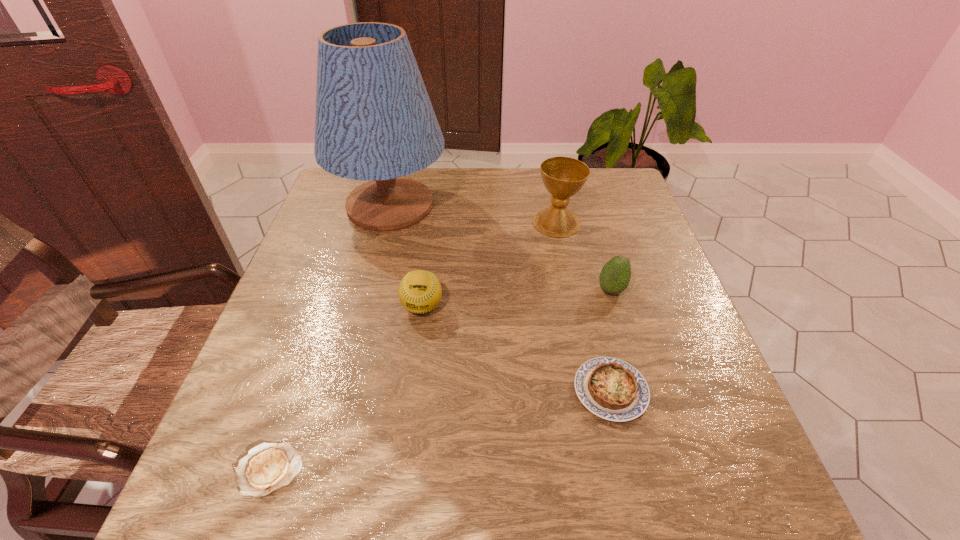
You are a GUI agent. You are given a task and a screenshot of the screen. Output one action in this format:
    pyautogui.click(x=<x>, y=<y>)
    Task: Click on the vacant point located between the avocado and the left quiche
    
    Given the screenshot: What is the action you would take?
    pyautogui.click(x=441, y=380)

In order to click on free spot between the fifth shortest object and the lampshade in this screenshot , I will do `click(473, 214)`.

Image resolution: width=960 pixels, height=540 pixels. What are the coordinates of `vacant space that is in between the shortest object and the avocado` in the screenshot? It's located at (441, 380).

Identify the location of free area in between the chalice and the softball. The height and width of the screenshot is (540, 960). (490, 265).

Locate an element on the screen. The image size is (960, 540). free space between the avocado and the right quiche is located at coordinates (611, 340).

Find the location of `free spot between the left quiche and the avocado`. free spot between the left quiche and the avocado is located at coordinates (441, 380).

Where is `vacant area between the shortest object and the softball`? The height and width of the screenshot is (540, 960). vacant area between the shortest object and the softball is located at coordinates (346, 388).

This screenshot has height=540, width=960. Find the location of `vacant region between the softball and the nearest object`. vacant region between the softball and the nearest object is located at coordinates (346, 388).

Locate an element on the screen. The height and width of the screenshot is (540, 960). object that ranks as the fourth closest to the chalice is located at coordinates (610, 388).

What are the coordinates of `object that is the fifth closest one to the softball` in the screenshot? It's located at (615, 275).